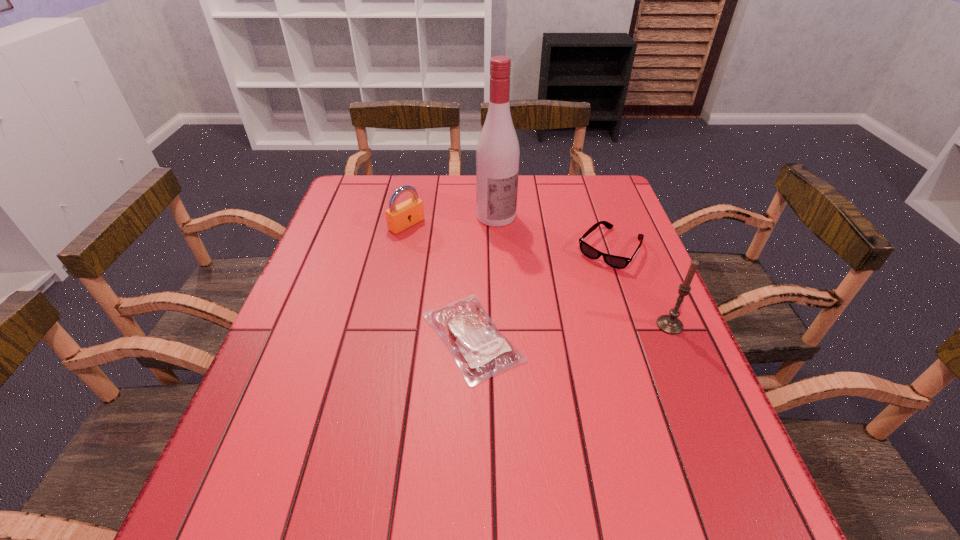
Locate an element on the screen. The image size is (960, 540). steak is located at coordinates (481, 351).

You are a GUI agent. You are given a task and a screenshot of the screen. Output one action in this format:
    pyautogui.click(x=<x>, y=<y>)
    Task: Click on the second tallest object
    
    Given the screenshot: What is the action you would take?
    pyautogui.click(x=670, y=324)

At what (x,y) coordinates should I click in order to perform the action: click on sunglasses. Please return your answer as a coordinate pair (x, y). Looking at the image, I should click on [x=619, y=262].

Locate an element on the screen. The width and height of the screenshot is (960, 540). the leftmost object is located at coordinates (399, 217).

Image resolution: width=960 pixels, height=540 pixels. In order to click on padlock in this screenshot , I will do `click(399, 217)`.

Locate an element on the screen. The image size is (960, 540). alcohol is located at coordinates (497, 154).

The image size is (960, 540). Find the location of `free region located 0.220m on the right of the shortest object`. free region located 0.220m on the right of the shortest object is located at coordinates (625, 337).

Image resolution: width=960 pixels, height=540 pixels. In order to click on free spot located on the left of the candle in this screenshot , I will do `click(564, 325)`.

Where is `vacant space situated on the front-facing side of the sunglasses`? Image resolution: width=960 pixels, height=540 pixels. vacant space situated on the front-facing side of the sunglasses is located at coordinates (552, 325).

The width and height of the screenshot is (960, 540). Find the location of `free space located 0.140m on the front-facing side of the sunglasses`. free space located 0.140m on the front-facing side of the sunglasses is located at coordinates (571, 299).